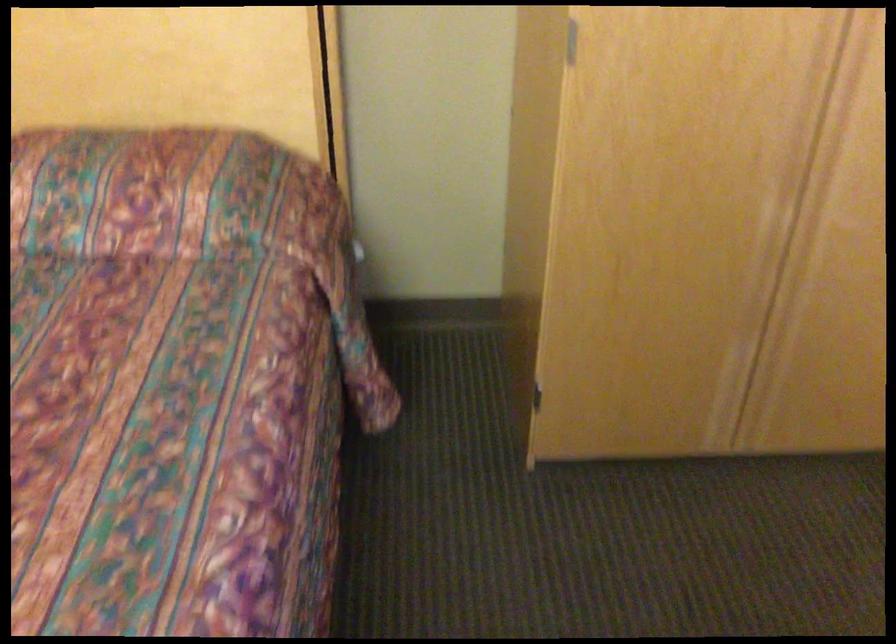
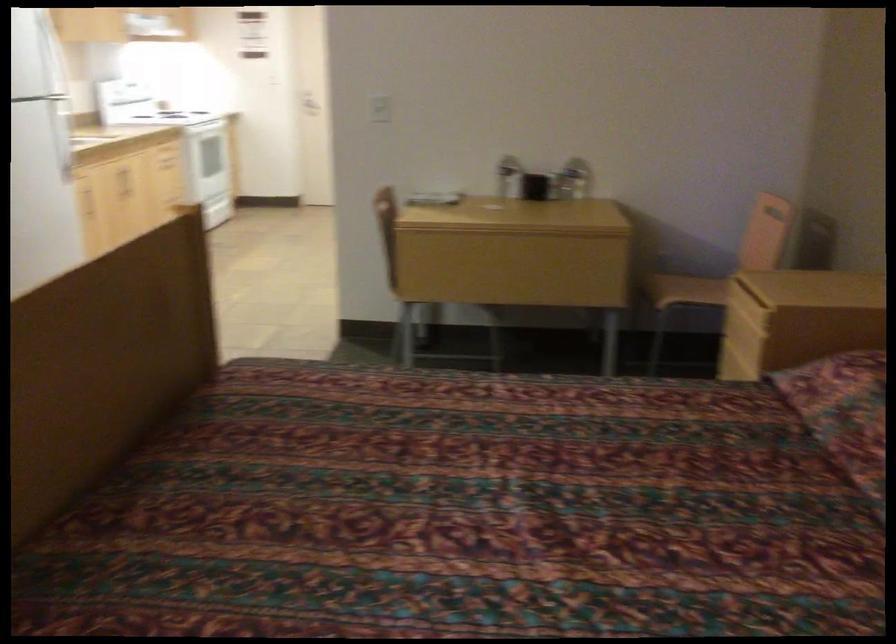
How did the camera likely rotate?

The rotation direction of the camera is left-down.